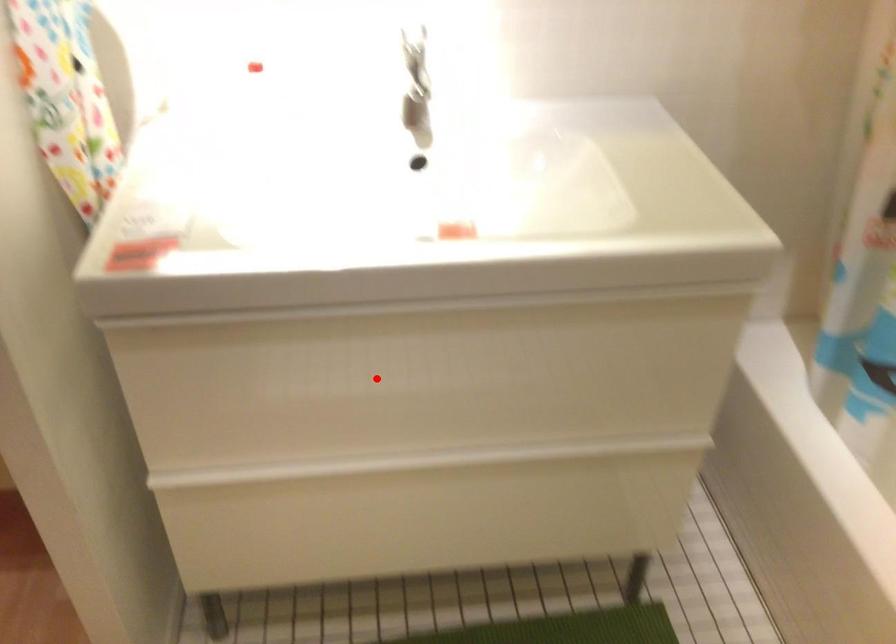
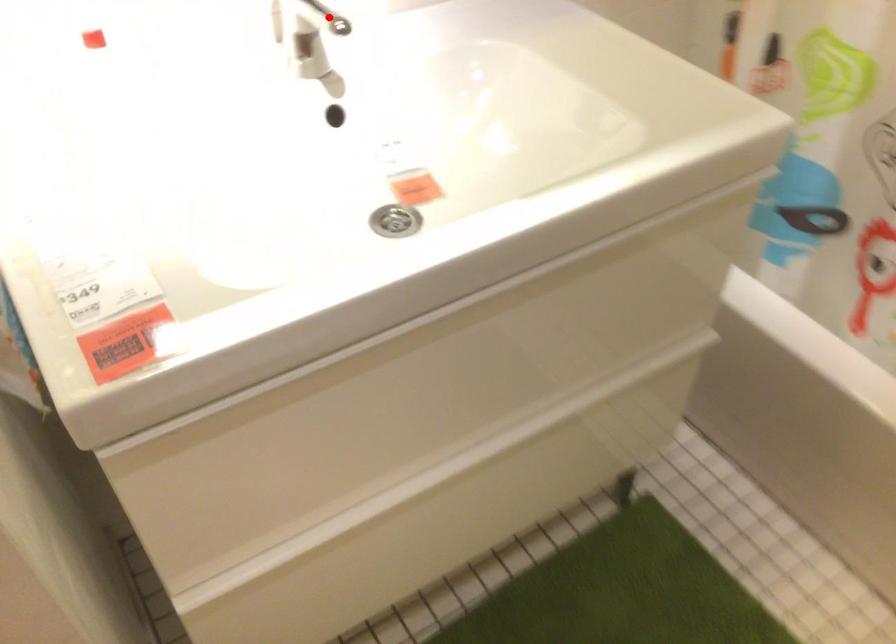
I am providing you with two images of the same scene from different viewpoints. A red point is marked on the first image and another point is marked on the second image. Does the point marked in image1 correspond to the same location as the one in image2?

No